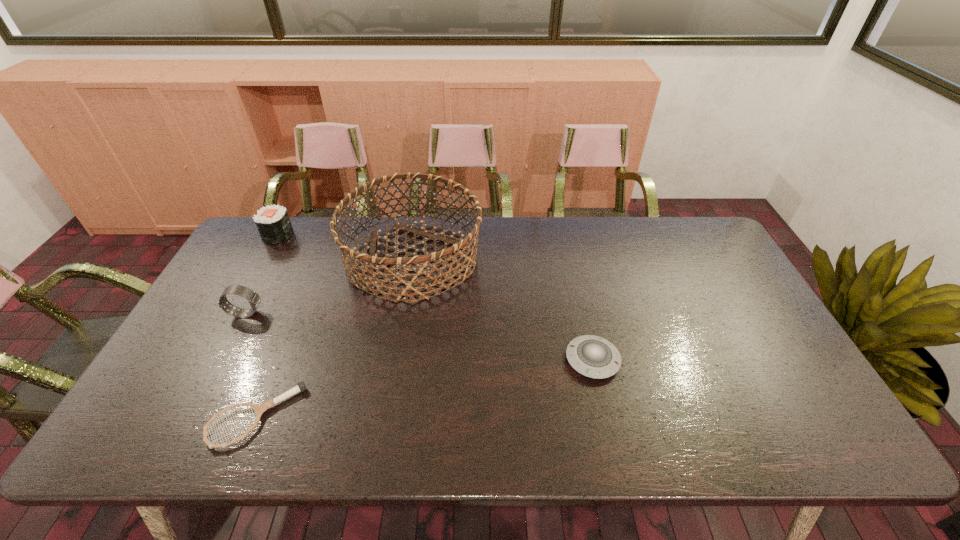
Where is `vacant space located 0.250m on the back of the rightmost object`? vacant space located 0.250m on the back of the rightmost object is located at coordinates (573, 276).

Locate an element on the screen. The width and height of the screenshot is (960, 540). vacant point located 0.210m on the right of the shortest object is located at coordinates (389, 416).

Where is `basket present at the far edge`? The width and height of the screenshot is (960, 540). basket present at the far edge is located at coordinates (371, 258).

This screenshot has height=540, width=960. I want to click on sushi that is at the far edge, so [273, 223].

Identify the location of object that is at the near edge. pos(259,408).

The width and height of the screenshot is (960, 540). I want to click on sushi at the left edge, so click(273, 223).

Find the location of a particular element. This screenshot has width=960, height=540. watch at the left edge is located at coordinates (254, 299).

I want to click on object present at the far left corner, so click(273, 223).

Where is `blank space at the far edge of the desktop`? The width and height of the screenshot is (960, 540). blank space at the far edge of the desktop is located at coordinates (598, 234).

Locate an element on the screen. This screenshot has height=540, width=960. free space at the near edge of the desktop is located at coordinates (340, 447).